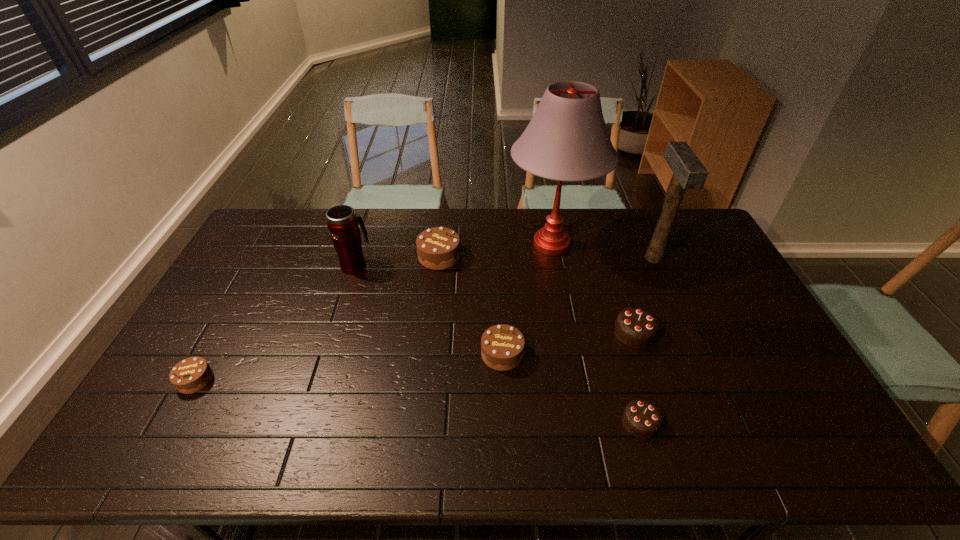
Where is `vacant region located on the side with the handle of the second object from left to right`? Image resolution: width=960 pixels, height=540 pixels. vacant region located on the side with the handle of the second object from left to right is located at coordinates (372, 211).

At what (x,y) coordinates should I click in order to perform the action: click on vacant space located 0.090m on the side with the handle of the second object from left to right. Please return your answer as a coordinate pair (x, y). Looking at the image, I should click on (363, 239).

Find the location of a particular element. free location located on the left of the fifth shortest object is located at coordinates 404,256.

You are a GUI agent. You are given a task and a screenshot of the screen. Output one action in this format:
    pyautogui.click(x=<x>, y=<y>)
    Task: Click on the vacant space located 0.270m on the back of the third chocolate cake from left to right
    This screenshot has height=540, width=960.
    Given the screenshot: What is the action you would take?
    pyautogui.click(x=498, y=275)

This screenshot has width=960, height=540. I want to click on free space located on the back of the bigger chocolate chocolate cake, so click(x=603, y=239).

At what (x,y) coordinates should I click in order to perform the action: click on vacant space situated on the right of the leftmost chocolate cake. Please return your answer as a coordinate pair (x, y). The width and height of the screenshot is (960, 540). Looking at the image, I should click on (327, 380).

Identify the location of vacant region located 0.110m on the back of the nearest chocolate cake. (625, 370).

This screenshot has width=960, height=540. Find the location of `table lamp present at the far edge`. table lamp present at the far edge is located at coordinates (567, 140).

You are a GUI agent. You are given a task and a screenshot of the screen. Output one action in this format:
    pyautogui.click(x=<x>, y=<y>)
    Task: Click on the mallet at the far edge
    The image size is (960, 540).
    Given the screenshot: What is the action you would take?
    pyautogui.click(x=688, y=172)

The image size is (960, 540). Identify the location of chocolate cake present at the far edge. (438, 248).